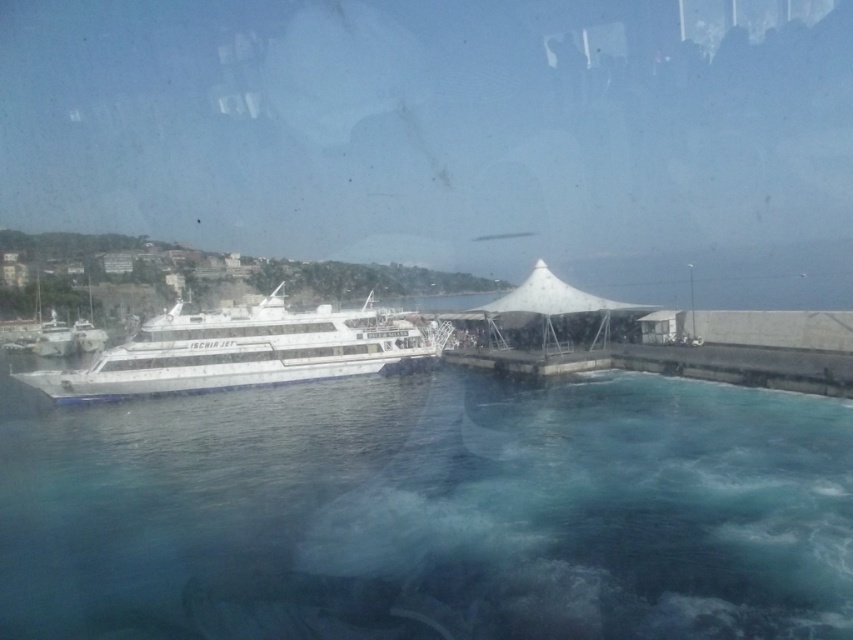
Between clear blue water at lower center and white fabric canopy at center, which one has more height?

With more height is white fabric canopy at center.

Does clear blue water at lower center have a lesser height compared to white fabric canopy at center?

Yes.

Between point (236, 428) and point (573, 289), which one is positioned in front?

Point (236, 428) is in front.

Find the location of a particular element. clear blue water at lower center is located at coordinates (428, 513).

Measure the distance between clear blue water at lower center and white glossy cruise ship at center.

The distance of clear blue water at lower center from white glossy cruise ship at center is 12.22 meters.

Between point (412, 637) and point (409, 330), which one is positioned behind?

Point (409, 330)

Is point (218, 564) closer to camera compared to point (263, 360)?

Yes, point (218, 564) is in front of point (263, 360).

Locate an element on the screen. Image resolution: width=853 pixels, height=640 pixels. clear blue water at lower center is located at coordinates coord(428,513).

Consider the image. Is white glossy cruise ship at center smaller than white fabric canopy at center?

Actually, white glossy cruise ship at center might be larger than white fabric canopy at center.

Who is more forward, (257, 323) or (579, 321)?

Point (257, 323)

Is point (160, 330) positioned in front of point (601, 308)?

Yes, it is.

The image size is (853, 640). Find the location of `white glossy cruise ship at center`. white glossy cruise ship at center is located at coordinates (242, 349).